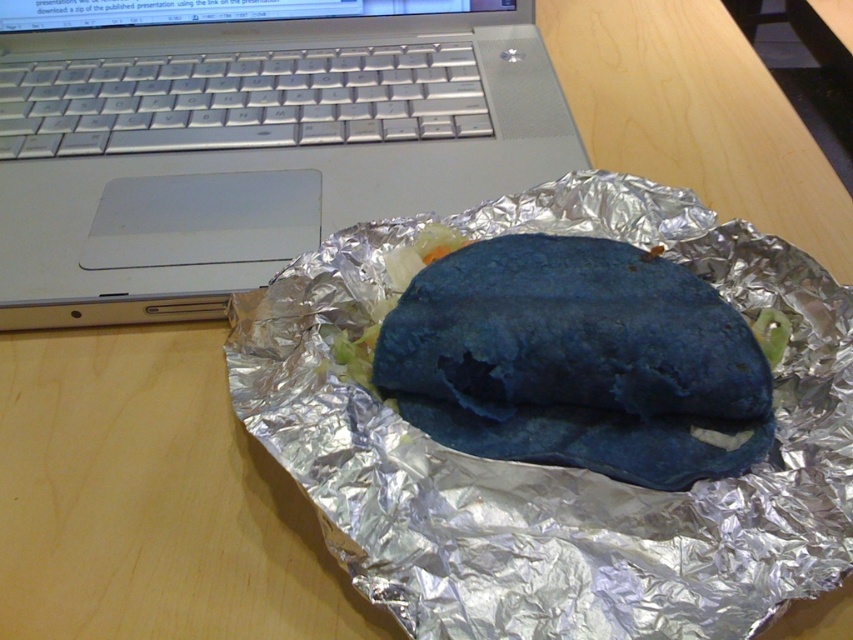
Question: In this image, where is shiny metallic foil at center located relative to blue matte burrito at center?

Choices:
 (A) left
 (B) right

Answer: (A)

Question: Estimate the real-world distances between objects in this image. Which object is closer to the shiny metallic foil at center?

Choices:
 (A) silver metallic laptop at upper left
 (B) blue matte burrito at center

Answer: (B)

Question: Can you confirm if silver metallic laptop at upper left is wider than blue matte burrito at center?

Choices:
 (A) yes
 (B) no

Answer: (A)

Question: Which point is farther from the camera taking this photo?

Choices:
 (A) click(490, 40)
 (B) click(842, 490)
 (C) click(474, 362)

Answer: (A)

Question: Which object is farther from the camera taking this photo?

Choices:
 (A) silver metallic laptop at upper left
 (B) blue matte burrito at center

Answer: (A)

Question: Is silver metallic laptop at upper left to the right of blue matte burrito at center from the viewer's perspective?

Choices:
 (A) no
 (B) yes

Answer: (A)